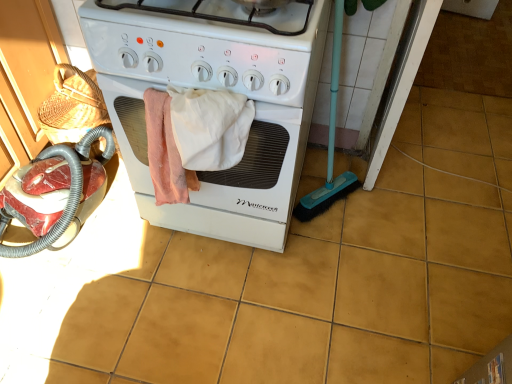
Find the location of a particular element. free spot behind yellow matte tile at center is located at coordinates (470, 150).